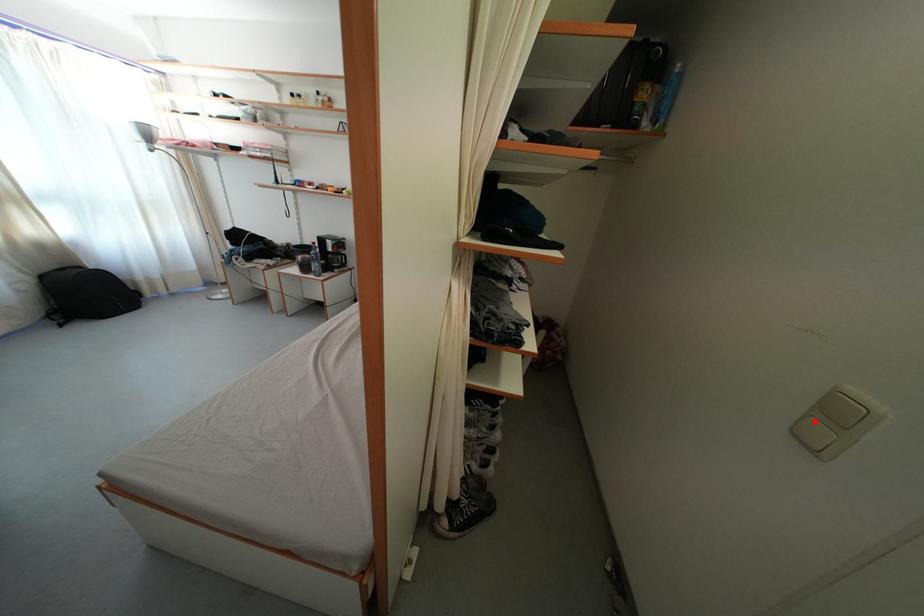
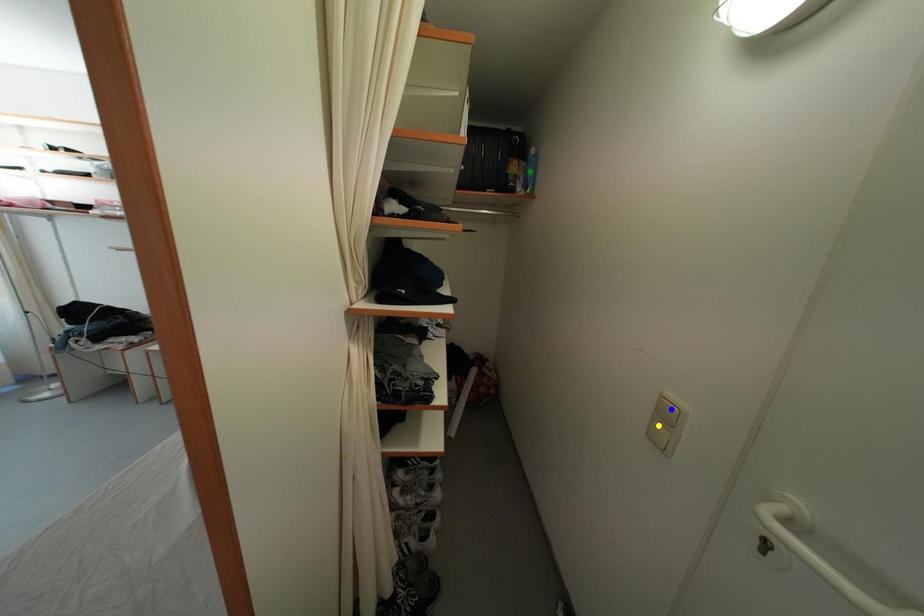
Question: I am providing you with two images of the same scene from different viewpoints. A red point is marked on the first image. You are given multiple points on the second image. Can you choose the point in image 2 that corresponds to the point in image 1?

Choices:
 (A) green point
 (B) blue point
 (C) yellow point

Answer: (C)